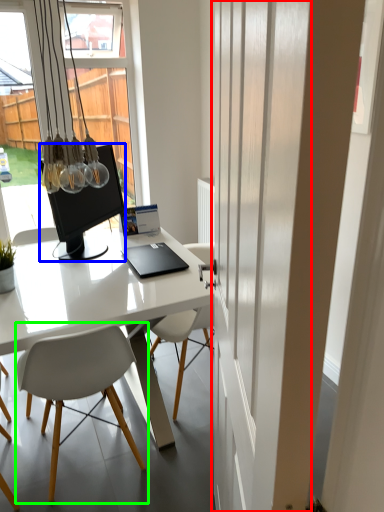
Question: Considering the real-world distances, which object is closest to screen door (highlighted by a red box)? television (highlighted by a blue box) or chair (highlighted by a green box).

Choices:
 (A) television
 (B) chair

Answer: (B)